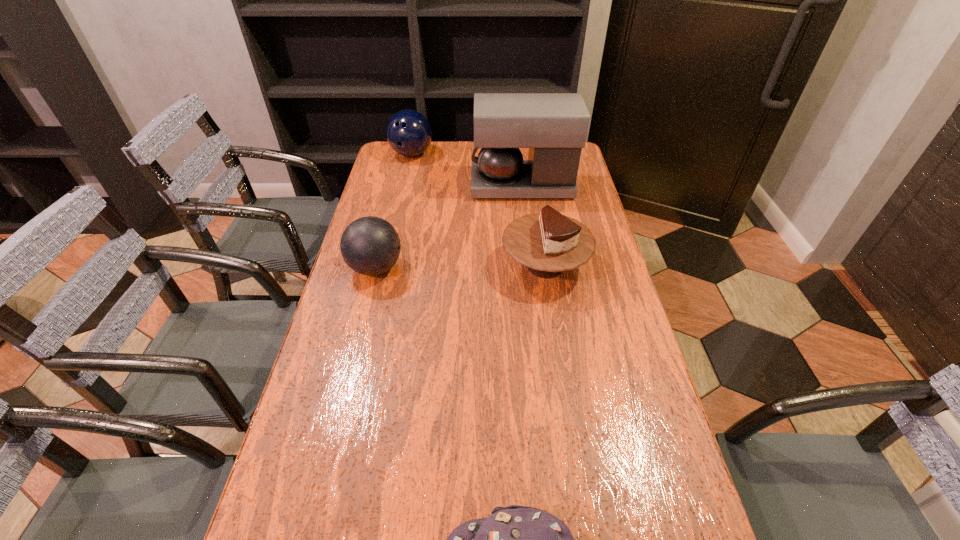
The image size is (960, 540). Find the location of `the fourth nearest object`. the fourth nearest object is located at coordinates (554, 126).

Image resolution: width=960 pixels, height=540 pixels. Find the location of `the tallest object`. the tallest object is located at coordinates (554, 126).

Locate an element on the screen. The image size is (960, 540). the farther bowling ball is located at coordinates (408, 132).

The height and width of the screenshot is (540, 960). Identify the location of cake. (548, 242).

Find the location of a particular element. the nearer bowling ball is located at coordinates (370, 245).

The image size is (960, 540). Find the location of `vacant space located on the carafe side of the tallest object`. vacant space located on the carafe side of the tallest object is located at coordinates (458, 186).

Find the location of a particular element. The image size is (960, 540). free space located 0.070m on the carafe side of the tallest object is located at coordinates (452, 186).

You are a GUI agent. You are given a task and a screenshot of the screen. Output one action in this format:
    pyautogui.click(x=<x>, y=<y>)
    Task: Click on the vacant space located 0.150m on the carafe side of the tallest object
    
    Given the screenshot: What is the action you would take?
    pyautogui.click(x=431, y=186)

This screenshot has width=960, height=540. I want to click on vacant space located 0.390m on the surface of the farthest object near the finger holes, so click(396, 226).

The height and width of the screenshot is (540, 960). In order to click on vacant space situated 0.210m on the back of the cake in this screenshot , I will do `click(535, 201)`.